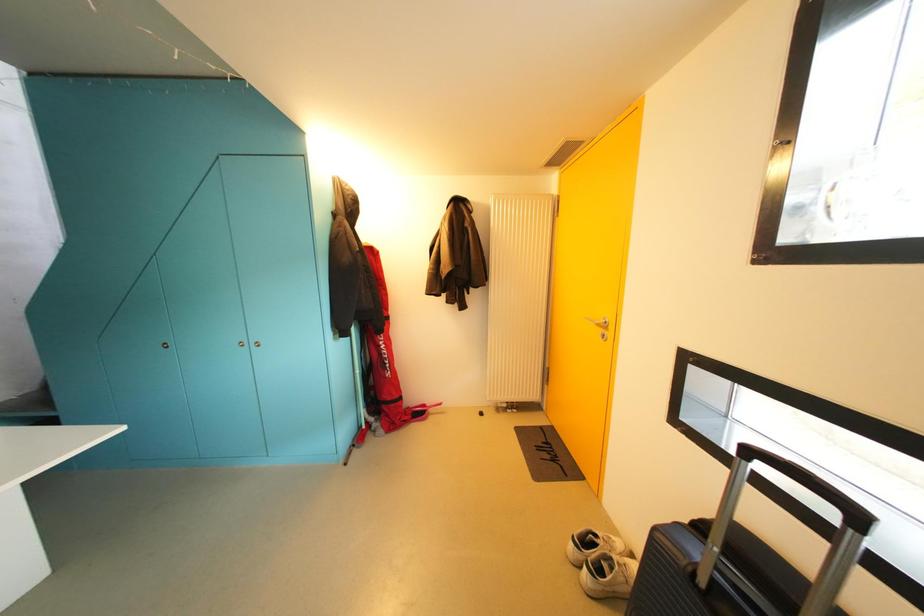
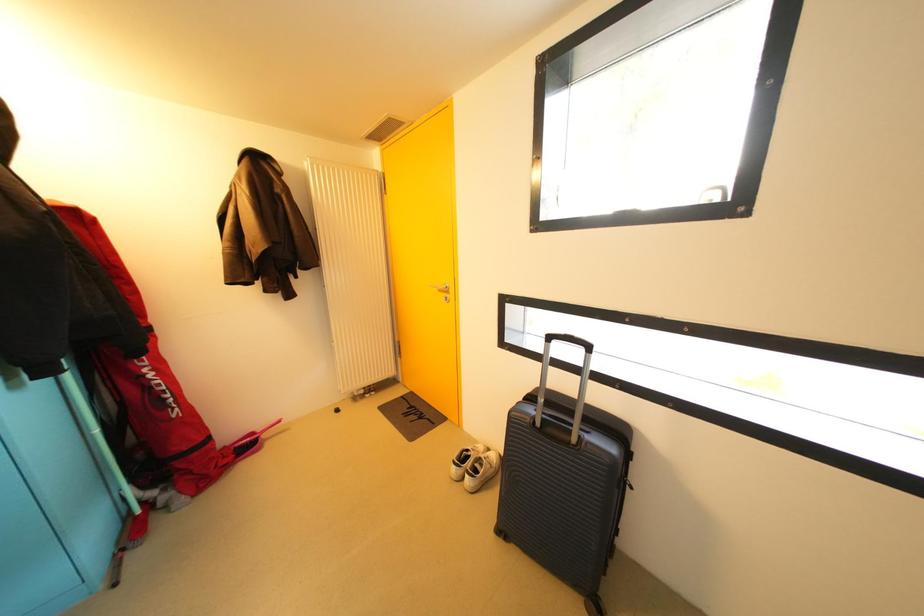
Question: How did the camera likely rotate?

Choices:
 (A) Left
 (B) Right
 (C) Up
 (D) Down

Answer: (B)